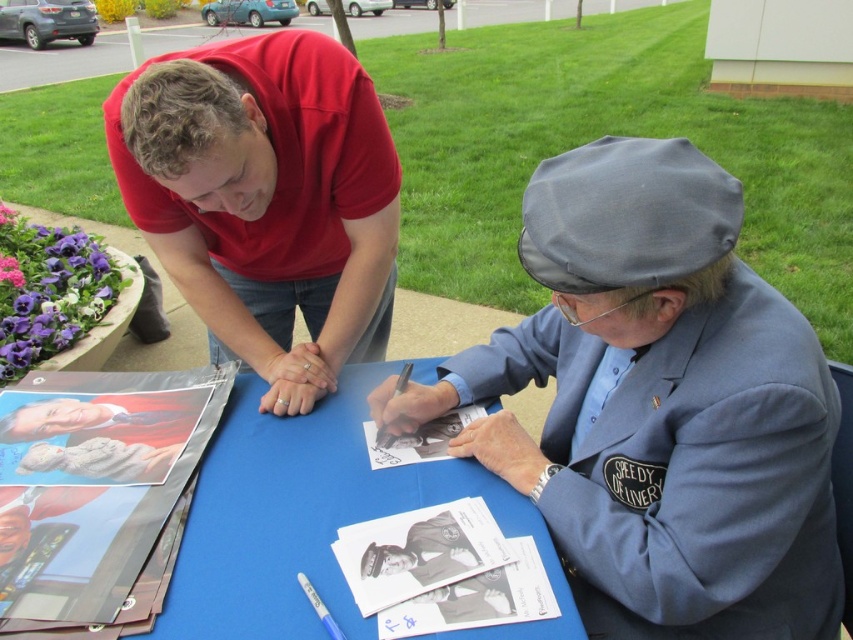
Question: Is gray fabric cap at center to the left of blue paper at center from the viewer's perspective?

Choices:
 (A) no
 (B) yes

Answer: (A)

Question: Which point is farther to the camera?

Choices:
 (A) (614, 483)
 (B) (373, 192)

Answer: (B)

Question: Does gray fabric cap at center have a greater width compared to red cotton shirt at upper left?

Choices:
 (A) no
 (B) yes

Answer: (B)

Question: Which object appears farthest from the camera in this image?

Choices:
 (A) red cotton shirt at upper left
 (B) gray fabric cap at center
 (C) blue paper at center
 (D) white cotton shirt at lower left

Answer: (D)

Question: Does smooth glossy photo at lower left have a smaller size compared to white cotton shirt at lower left?

Choices:
 (A) no
 (B) yes

Answer: (A)

Question: Which point is closer to the camera taking this photo?

Choices:
 (A) (552, 268)
 (B) (91, 440)

Answer: (A)